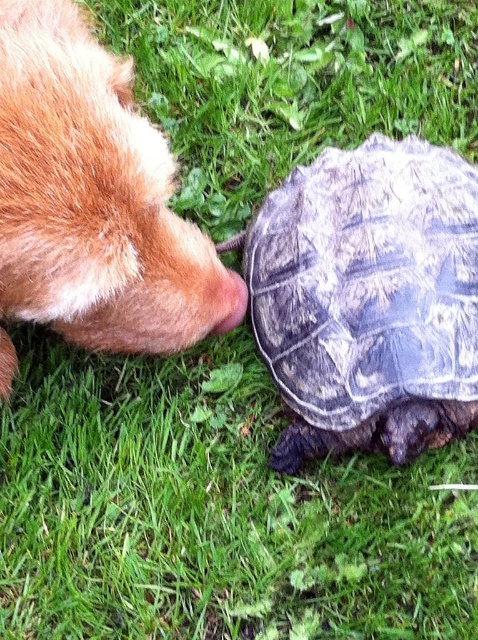
Measure the distance between fuzzy fur nose at left and brown fur nose at left.

fuzzy fur nose at left is 12.83 inches away from brown fur nose at left.

Does fuzzy fur nose at left have a greater height compared to brown fur nose at left?

Correct, fuzzy fur nose at left is much taller as brown fur nose at left.

Does point (29, 282) lie in front of point (228, 324)?

Yes, it is.

Locate an element on the screen. Image resolution: width=478 pixels, height=640 pixels. fuzzy fur nose at left is located at coordinates (91, 196).

Between point (357, 164) and point (71, 76), which one is positioned behind?

The point (357, 164) is more distant.

I want to click on leathery brown tortoise at center, so click(368, 300).

Can you confirm if leathery brown tortoise at center is smaller than brown fur nose at left?

Incorrect, leathery brown tortoise at center is not smaller in size than brown fur nose at left.

Which is behind, point (355, 252) or point (239, 321)?

Point (355, 252)

Is point (346, 266) behind point (228, 330)?

Yes, point (346, 266) is behind point (228, 330).

Locate an element on the screen. This screenshot has height=640, width=478. leathery brown tortoise at center is located at coordinates (368, 300).